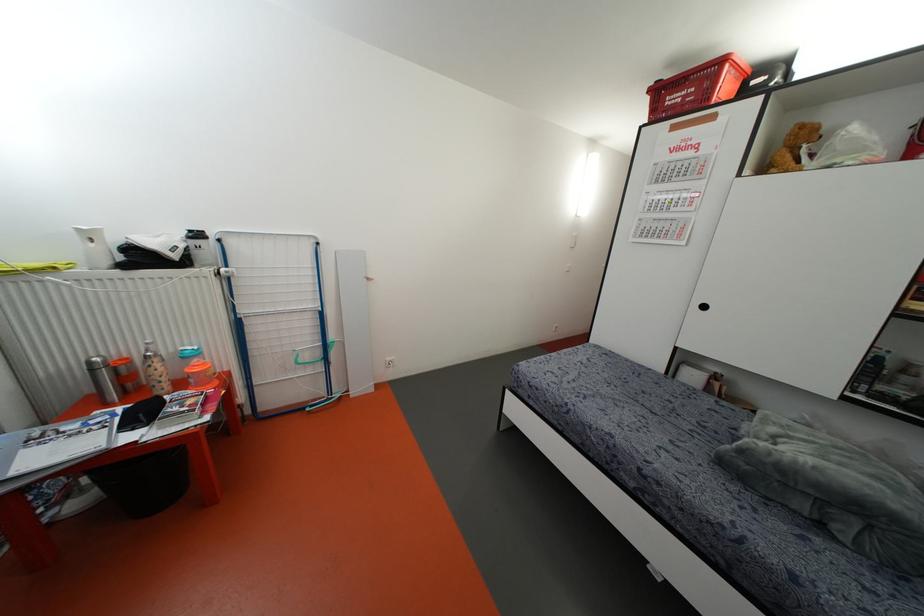
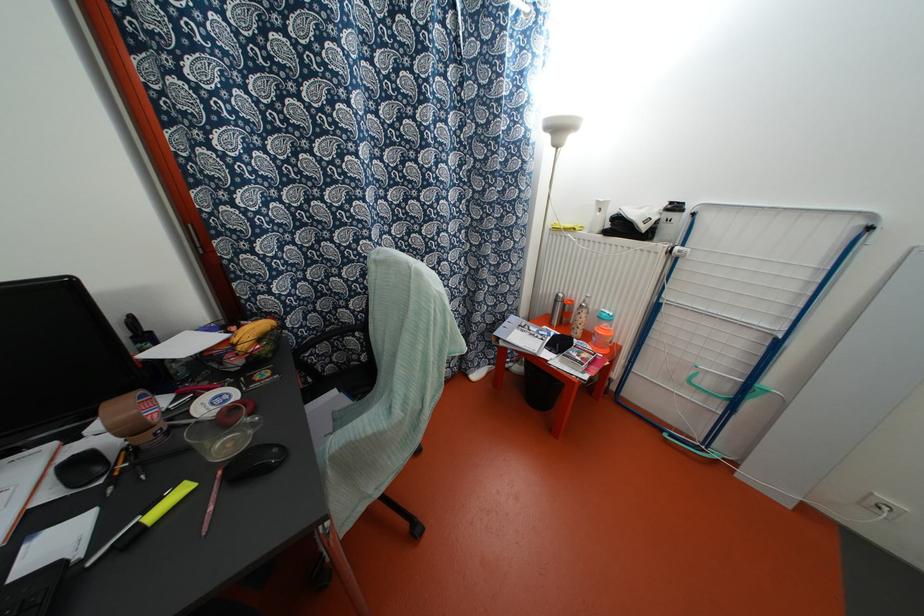
Where in the second image is the point corresponding to point (107, 262) from the first image?

(599, 228)